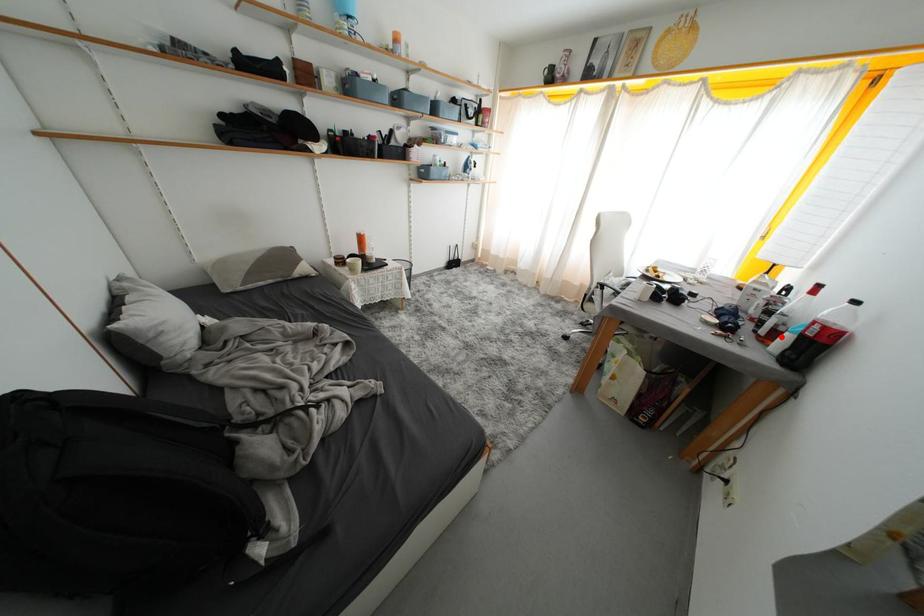
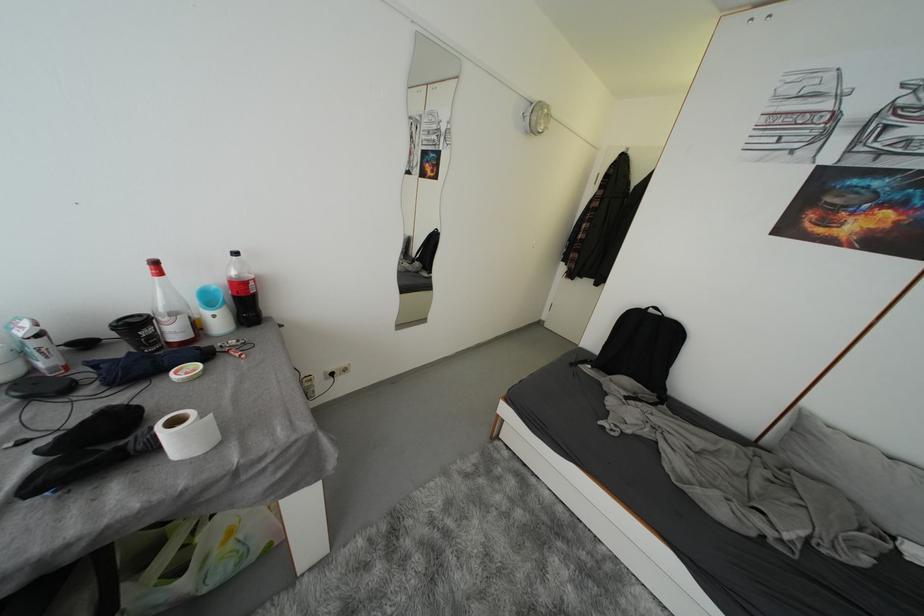
Find the pixel in the second image that matches the highlighted location in the first image.

(202, 329)